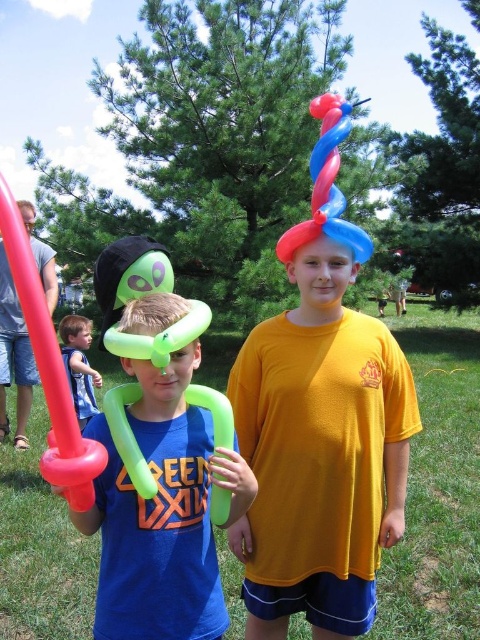
Question: Based on their relative distances, which object is nearer to the light blue denim shirt at lower left?

Choices:
 (A) matte yellow t-shirt at center
 (B) green rubber balloon at center

Answer: (A)

Question: Which point is farther to the camera?

Choices:
 (A) (12, 252)
 (B) (210, 509)

Answer: (B)

Question: Estimate the real-world distances between objects in this image. Which object is closer to the matte yellow t-shirt at center?

Choices:
 (A) green rubber balloon at center
 (B) rubber balloon sword at left
 (C) light blue denim shirt at lower left
 (D) shiny blue balloon hat at center

Answer: (A)

Question: Can you confirm if rubber balloon sword at left is bigger than shiny blue balloon hat at center?

Choices:
 (A) yes
 (B) no

Answer: (B)

Question: Is green matte balloon sword at left closer to camera compared to shiny blue balloon hat at center?

Choices:
 (A) no
 (B) yes

Answer: (B)

Question: Can you confirm if green rubber balloon at center is positioned above light blue denim shirt at lower left?

Choices:
 (A) no
 (B) yes

Answer: (B)